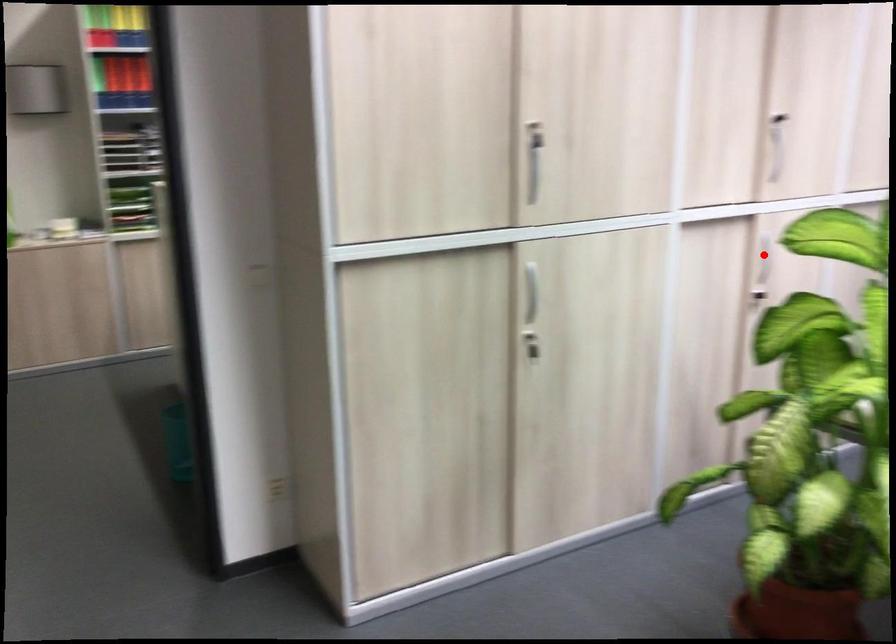
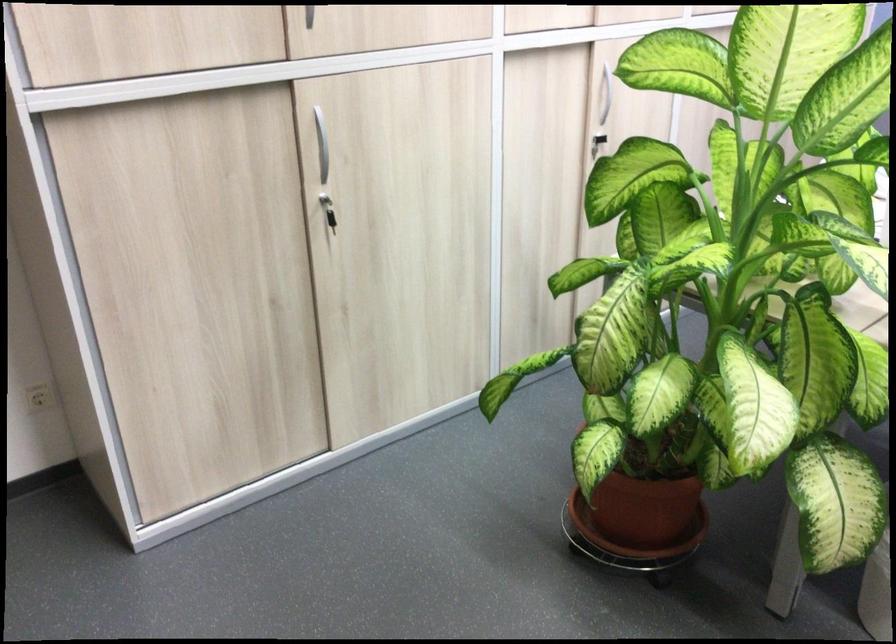
Question: I am providing you with two images of the same scene from different viewpoints. In image1, a red point is highlighted. Considering the same 3D point in image2, which of the following is correct?

Choices:
 (A) It is closer
 (B) It is farther

Answer: (A)